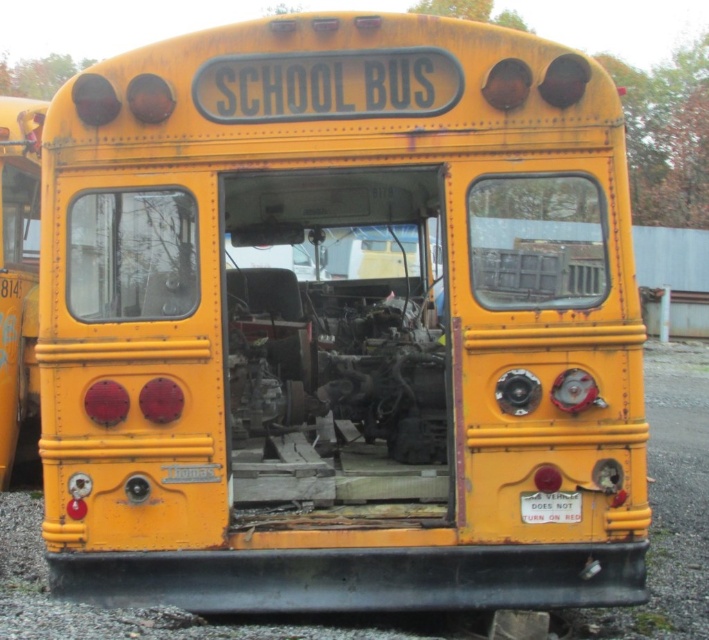
Question: Is matte yellow school bus at left bigger than metallic gray license plate at center?

Choices:
 (A) no
 (B) yes

Answer: (B)

Question: Which object appears farthest from the camera in this image?

Choices:
 (A) matte yellow school bus at left
 (B) metallic gray license plate at center

Answer: (A)

Question: Which object is closer to the camera taking this photo?

Choices:
 (A) metallic gray license plate at center
 (B) matte yellow school bus at left

Answer: (A)

Question: Observing the image, what is the correct spatial positioning of matte yellow school bus at left in reference to metallic gray license plate at center?

Choices:
 (A) right
 (B) left

Answer: (B)

Question: Among these points, which one is nearest to the camera?

Choices:
 (A) (559, 520)
 (B) (18, 106)

Answer: (A)

Question: Where is matte yellow school bus at left located in relation to metallic gray license plate at center in the image?

Choices:
 (A) below
 (B) above

Answer: (B)